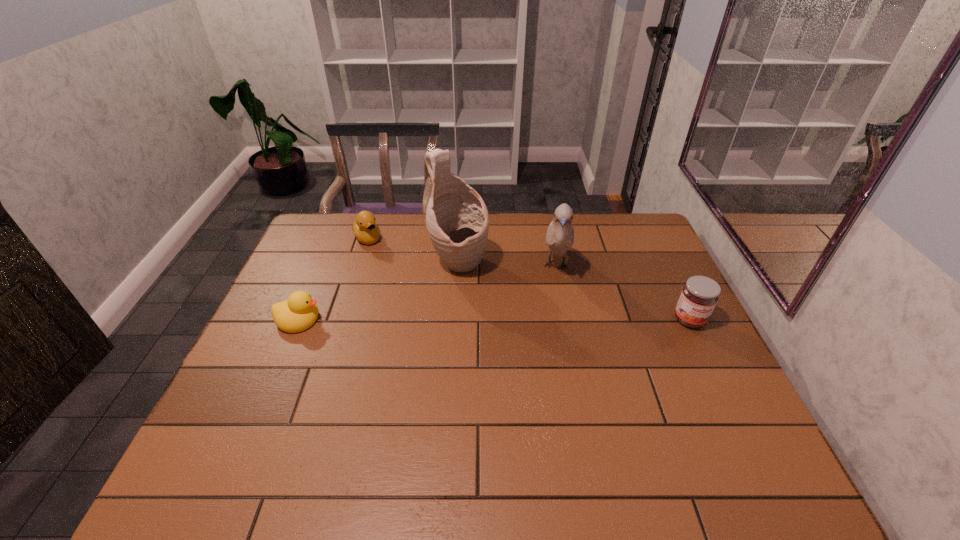
You are a GUI agent. You are given a task and a screenshot of the screen. Output one action in this format:
    pyautogui.click(x=<x>, y=<y>)
    Task: Click on the free space located 0.310m on the left of the jam
    
    Given the screenshot: What is the action you would take?
    pyautogui.click(x=565, y=320)

Locate an element on the screen. free space located 0.210m facing forward on the right duckling is located at coordinates (400, 280).

Locate an element on the screen. This screenshot has height=540, width=960. free space located 0.180m facing forward on the right duckling is located at coordinates (396, 274).

Find the location of a particular element. This screenshot has height=540, width=960. free space located 0.330m facing forward on the right duckling is located at coordinates (420, 301).

Identify the location of free space located at the spout of the tallest object. Image resolution: width=960 pixels, height=540 pixels. (526, 319).

I want to click on vacant area located 0.300m at the spout of the tallest object, so click(x=546, y=335).

Where is `free space located at the spout of the tallest object`? This screenshot has width=960, height=540. free space located at the spout of the tallest object is located at coordinates (537, 327).

Image resolution: width=960 pixels, height=540 pixels. Identify the location of blank space located 0.270m at the beak of the bird. (552, 358).

Where is `vacant space located at the beak of the bird`? The image size is (960, 540). vacant space located at the beak of the bird is located at coordinates (552, 358).

I want to click on vacant space positioned at the beak of the bird, so click(550, 383).